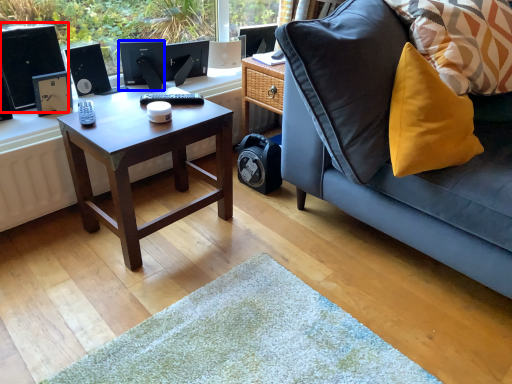
Question: Which of the following is the closest to the observer, desktop computer (highlighted by a red box) or computer monitor (highlighted by a blue box)?

Choices:
 (A) desktop computer
 (B) computer monitor

Answer: (A)